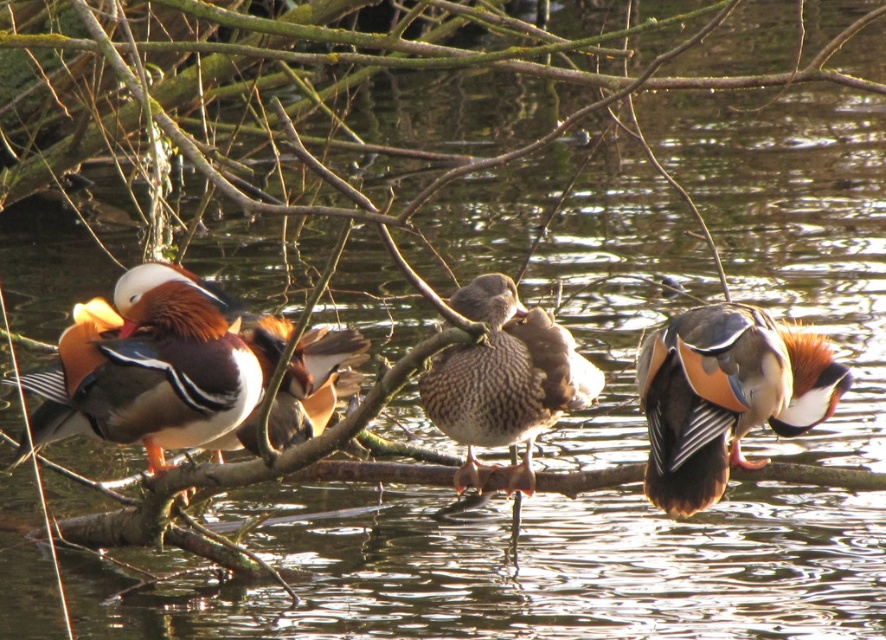
Question: Does shiny orange duck at right come in front of speckled feather duck at center?

Choices:
 (A) no
 (B) yes

Answer: (B)

Question: Which is nearer to the shiny brown duck at left?

Choices:
 (A) shiny orange duck at right
 (B) speckled feather duck at center

Answer: (B)

Question: Is shiny brown duck at left smaller than shiny orange duck at right?

Choices:
 (A) no
 (B) yes

Answer: (A)

Question: Is shiny orange duck at right in front of speckled feather duck at center?

Choices:
 (A) yes
 (B) no

Answer: (A)

Question: Which of the following is the closest to the observer?

Choices:
 (A) (704, 497)
 (B) (107, 412)
 (C) (434, 422)
 (D) (331, 348)

Answer: (A)

Question: Estimate the real-world distances between objects in this image. Which object is closer to the shiny brown duck at left?

Choices:
 (A) shiny orange duck at right
 (B) speckled feather duck at center
 (C) shiny orange duck at center

Answer: (C)